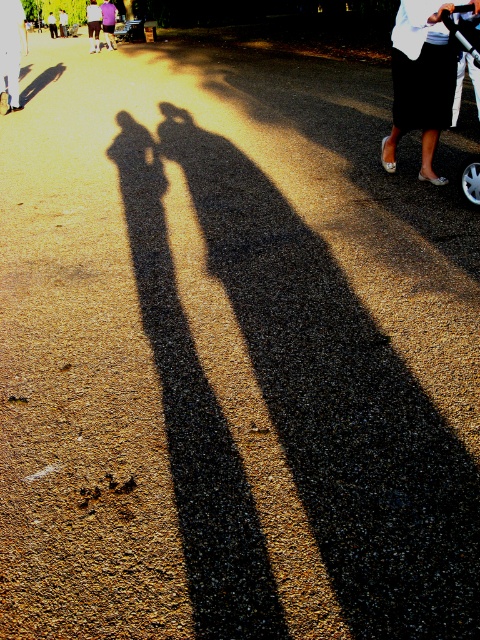
Question: Which object appears farthest from the camera in this image?

Choices:
 (A) purple cotton shirt at upper left
 (B) black satin skirt at upper right

Answer: (A)

Question: Which object is closer to the camera taking this photo?

Choices:
 (A) purple cotton shirt at upper left
 (B) black satin skirt at upper right
 (C) white plastic baby carriage at upper right

Answer: (C)

Question: In this image, where is black satin skirt at upper right located relative to white plastic baby carriage at upper right?

Choices:
 (A) left
 (B) right

Answer: (A)

Question: Is black satin skirt at upper right to the left of white cotton shirt at center from the viewer's perspective?

Choices:
 (A) yes
 (B) no

Answer: (B)

Question: Which of these objects is positioned closest to the purple cotton shirt at upper left?

Choices:
 (A) white plastic baby carriage at upper right
 (B) white cotton shirt at center
 (C) black satin skirt at upper right

Answer: (B)

Question: Does white plastic baby carriage at upper right appear on the right side of purple cotton shirt at upper left?

Choices:
 (A) no
 (B) yes

Answer: (B)